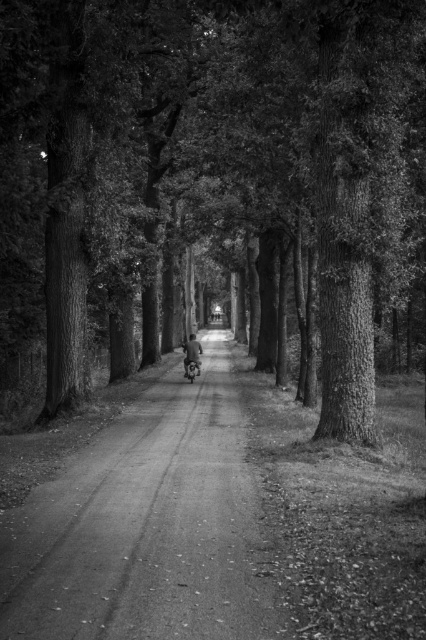
You are standing at the start of the tree lined path and want to reach the point at coordinates (147, 525). The path is a dirt road with tire tracks. Is the point located on the dirt road or on a different surface?

The point at coordinates (147, 525) is on smooth asphalt road at center, so it is located on a different surface from the dirt road.